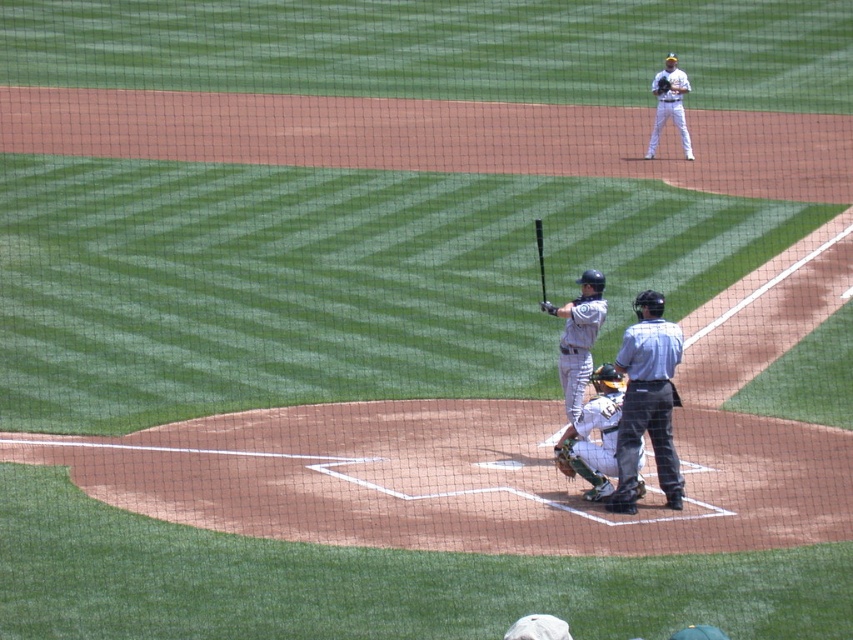
Question: Is white leather catcher at center wider than dark green leather glove at center?

Choices:
 (A) no
 (B) yes

Answer: (B)

Question: Which of these objects is positioned farthest from the dark brown leather glove at upper right?

Choices:
 (A) gray uniform at center
 (B) brown leather glove at home plate
 (C) matte black bat at center

Answer: (B)

Question: Observing the image, what is the correct spatial positioning of gray uniform at center in reference to brown leather glove at home plate?

Choices:
 (A) right
 (B) left

Answer: (A)

Question: Where is gray uniform bat at center located in relation to matte black bat at center in the image?

Choices:
 (A) left
 (B) right

Answer: (B)

Question: Which object is closer to the camera taking this photo?

Choices:
 (A) dark green leather glove at center
 (B) matte black bat at center
 (C) gray uniform at center

Answer: (C)

Question: Which point is closer to the camera taking this photo?

Choices:
 (A) (540, 308)
 (B) (627, 509)

Answer: (B)